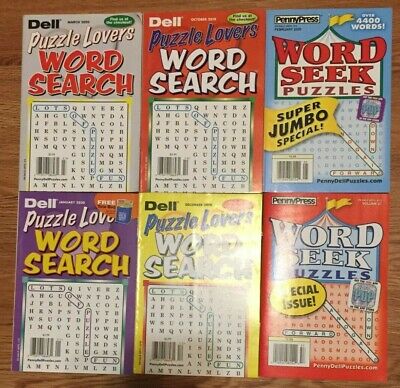
Identify the location of light grey book. The image size is (400, 388). (136, 121).